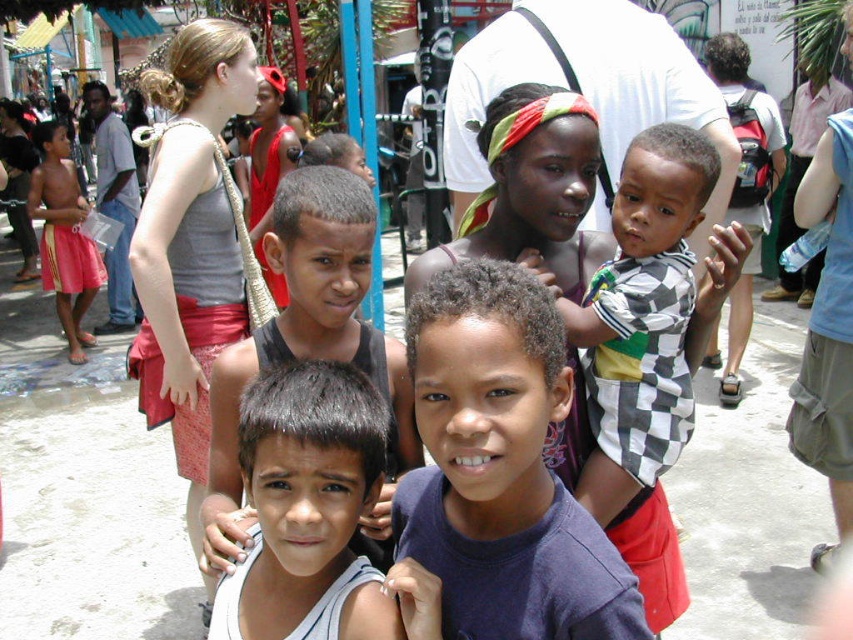
Does purple cotton shirt at center have a lesser height compared to dark brown hair at center?

Yes.

Looking at this image, is purple cotton shirt at center to the left of dark brown hair at center from the viewer's perspective?

In fact, purple cotton shirt at center is to the right of dark brown hair at center.

Does point (399, 513) come closer to viewer compared to point (337, 211)?

Yes, it is in front of point (337, 211).

You are a GUI agent. You are given a task and a screenshot of the screen. Output one action in this format:
    pyautogui.click(x=<x>, y=<y>)
    Task: Click on the purple cotton shirt at center
    
    Given the screenshot: What is the action you would take?
    pyautogui.click(x=502, y=468)

Can you confirm if checkered fabric shirt at center is wider than white cotton tank top at center?

Yes, checkered fabric shirt at center is wider than white cotton tank top at center.

Between checkered fabric shirt at center and white cotton tank top at center, which one has less height?

white cotton tank top at center is shorter.

Is point (621, 236) closer to viewer compared to point (277, 420)?

No, (621, 236) is further to viewer.

Find the location of a particular element. This screenshot has width=853, height=640. checkered fabric shirt at center is located at coordinates (647, 316).

Who is shorter, white cotton tank top at center or dark brown hair at center?

white cotton tank top at center is shorter.

Which of these two, white cotton tank top at center or dark brown hair at center, stands taller?

Standing taller between the two is dark brown hair at center.

Who is more distant from viewer, (347, 493) or (350, 208)?

Point (350, 208)

In order to click on white cotton tank top at center in this screenshot , I will do `click(305, 486)`.